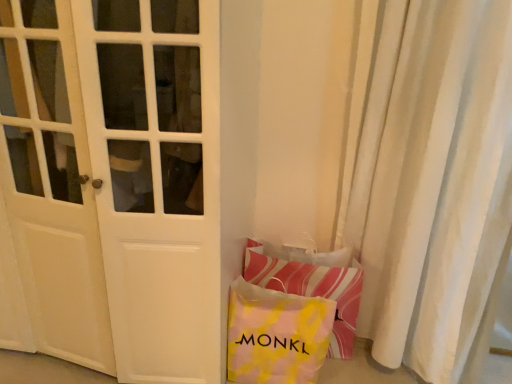
Question: From the image's perspective, is white matte door at center below white textured curtain at right?

Choices:
 (A) yes
 (B) no

Answer: (B)

Question: Can you confirm if white matte door at center is smaller than white textured curtain at right?

Choices:
 (A) yes
 (B) no

Answer: (B)

Question: Can you confirm if white matte door at center is wider than white textured curtain at right?

Choices:
 (A) yes
 (B) no

Answer: (A)

Question: Is white textured curtain at right at the back of white matte door at center?

Choices:
 (A) no
 (B) yes

Answer: (A)

Question: Is white matte door at center taller than white textured curtain at right?

Choices:
 (A) yes
 (B) no

Answer: (B)

Question: Considering the relative positions of yellow tie-dye fabric bag at lower right and white textured curtain at right in the image provided, is yellow tie-dye fabric bag at lower right to the left or to the right of white textured curtain at right?

Choices:
 (A) left
 (B) right

Answer: (A)

Question: Is point (252, 334) closer or farther from the camera than point (396, 362)?

Choices:
 (A) farther
 (B) closer

Answer: (B)

Question: From their relative heights in the image, would you say yellow tie-dye fabric bag at lower right is taller or shorter than white textured curtain at right?

Choices:
 (A) short
 (B) tall

Answer: (A)

Question: From the image's perspective, relative to white textured curtain at right, is yellow tie-dye fabric bag at lower right above or below?

Choices:
 (A) above
 (B) below

Answer: (B)

Question: Is striped fabric pillow at lower right in front of or behind white textured curtain at right in the image?

Choices:
 (A) front
 (B) behind

Answer: (B)

Question: In terms of height, does striped fabric pillow at lower right look taller or shorter compared to white textured curtain at right?

Choices:
 (A) tall
 (B) short

Answer: (B)

Question: Is striped fabric pillow at lower right to the left or to the right of white textured curtain at right in the image?

Choices:
 (A) left
 (B) right

Answer: (A)

Question: Is point click(x=275, y=276) positioned closer to the camera than point click(x=488, y=182)?

Choices:
 (A) closer
 (B) farther

Answer: (B)

Question: In the image, is white textured curtain at right positioned in front of or behind white matte door at center?

Choices:
 (A) behind
 (B) front

Answer: (A)

Question: Based on their sizes in the image, would you say white textured curtain at right is bigger or smaller than white matte door at center?

Choices:
 (A) small
 (B) big

Answer: (A)